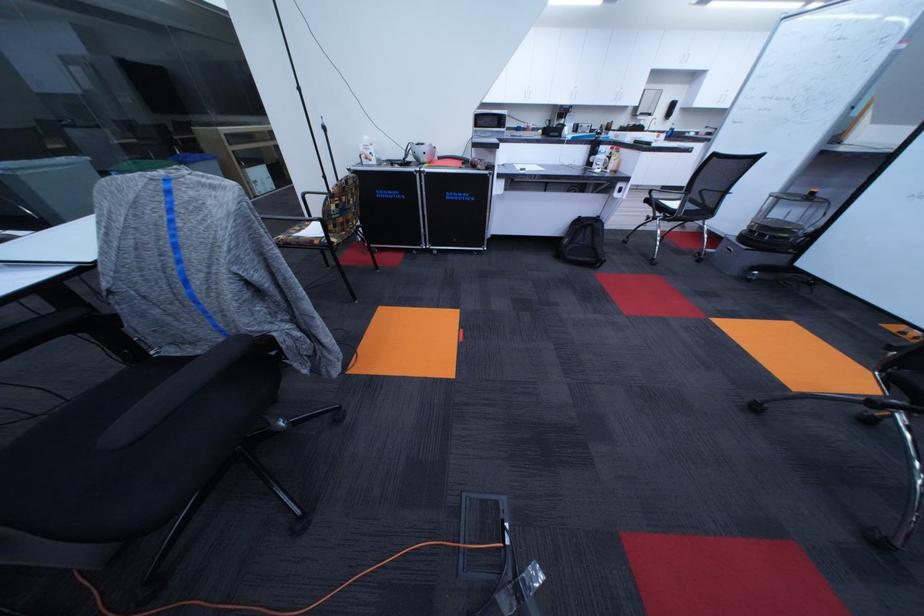
Find where to lift the black backpack. Please return your answer as a coordinate pair (x, y).

(582, 243)